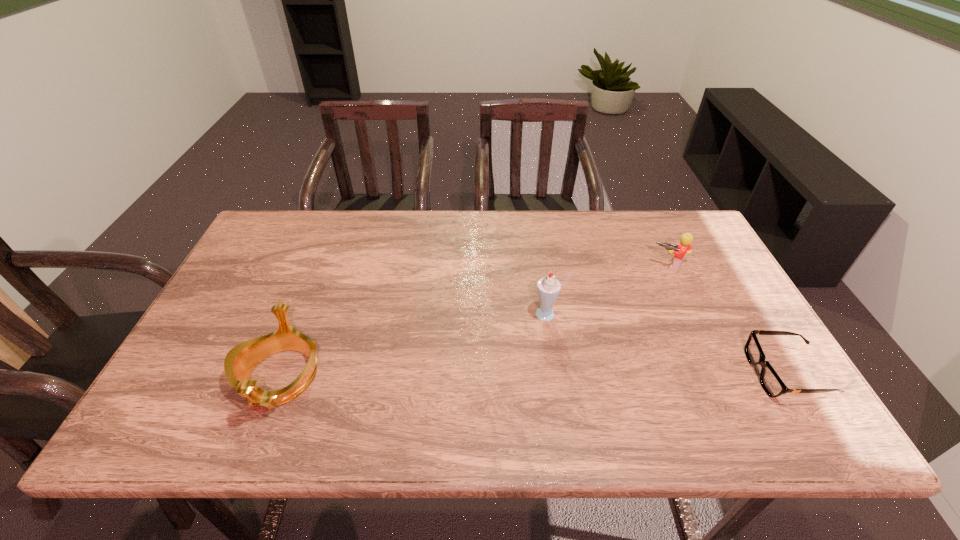
This screenshot has width=960, height=540. In order to click on tiara in this screenshot , I will do `click(241, 360)`.

I want to click on the shortest object, so click(770, 381).

Image resolution: width=960 pixels, height=540 pixels. In order to click on sunglasses in this screenshot , I will do `click(770, 381)`.

The height and width of the screenshot is (540, 960). I want to click on the third nearest object, so click(548, 288).

Identify the location of the third object from right to left. (548, 288).

Locate an element on the screen. the second object from right to left is located at coordinates (685, 245).

You are a GUI agent. You are given a task and a screenshot of the screen. Output one action in this format:
    pyautogui.click(x=<x>, y=<y>)
    Task: Click on the farthest object
    The width and height of the screenshot is (960, 540).
    Given the screenshot: What is the action you would take?
    pyautogui.click(x=685, y=245)

This screenshot has width=960, height=540. In order to click on free space located on the front-facing side of the rightmost object in this screenshot , I will do `click(586, 374)`.

Locate an element on the screen. This screenshot has height=540, width=960. vacant space located on the front-facing side of the rightmost object is located at coordinates (581, 374).

Where is `free space located on the front-facing side of the rightmost object`? Image resolution: width=960 pixels, height=540 pixels. free space located on the front-facing side of the rightmost object is located at coordinates (624, 374).